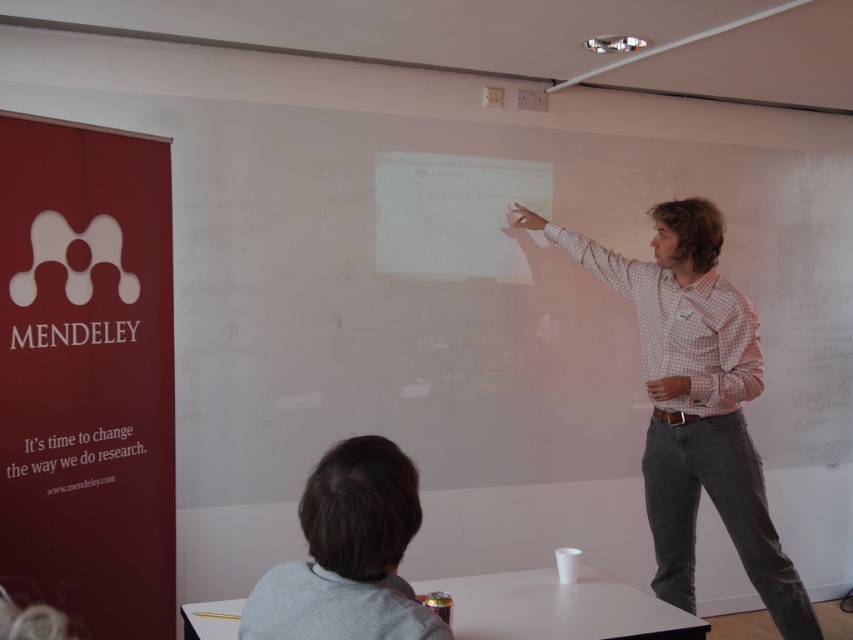
Question: Which object is the farthest from the white checkered shirt at upper right?

Choices:
 (A) gray cotton shirt at lower left
 (B) white paper at lower left
 (C) white matte projection screen at center

Answer: (B)

Question: Does white checkered shirt at upper right have a smaller size compared to gray cotton shirt at lower left?

Choices:
 (A) no
 (B) yes

Answer: (A)

Question: Among these objects, which one is farthest from the camera?

Choices:
 (A) white checkered shirt at upper right
 (B) white paper at lower left
 (C) white matte projection screen at center
 (D) gray cotton shirt at lower left

Answer: (C)

Question: Can you confirm if white checkered shirt at upper right is bigger than white matte projection screen at center?

Choices:
 (A) no
 (B) yes

Answer: (B)

Question: Does white checkered shirt at upper right appear over white matte projection screen at center?

Choices:
 (A) no
 (B) yes

Answer: (A)

Question: Which point appears farthest from the camera in this image?

Choices:
 (A) (386, 513)
 (B) (138, 429)
 (C) (653, 276)
 (D) (529, 198)

Answer: (D)